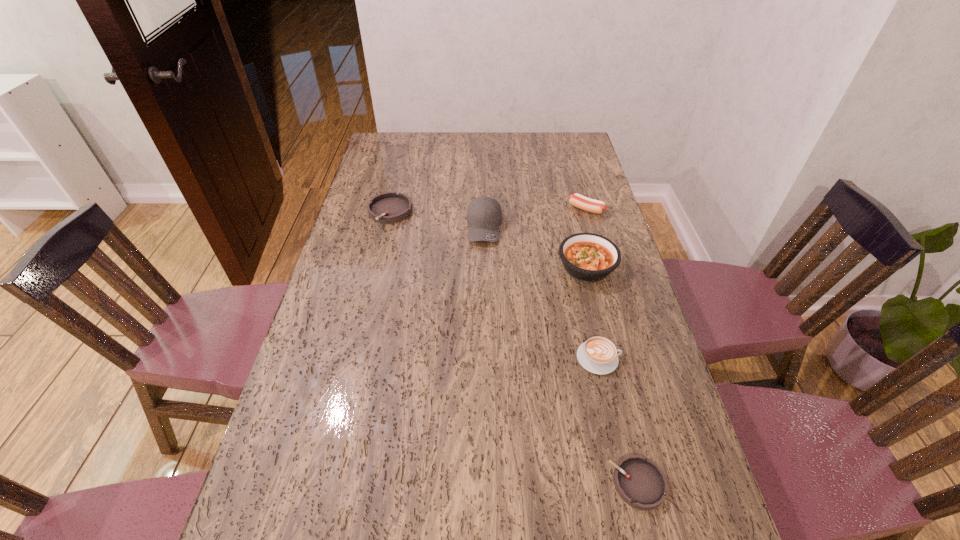
Please point a space for a new ashtray to maintain equal intervals. Please provide its 2D coordinates. Your answer should be formatted as a tuple, i.e. [(x, y)], where the tuple contains the x and y coordinates of a point satisfying the conditions above.

[(481, 312)]